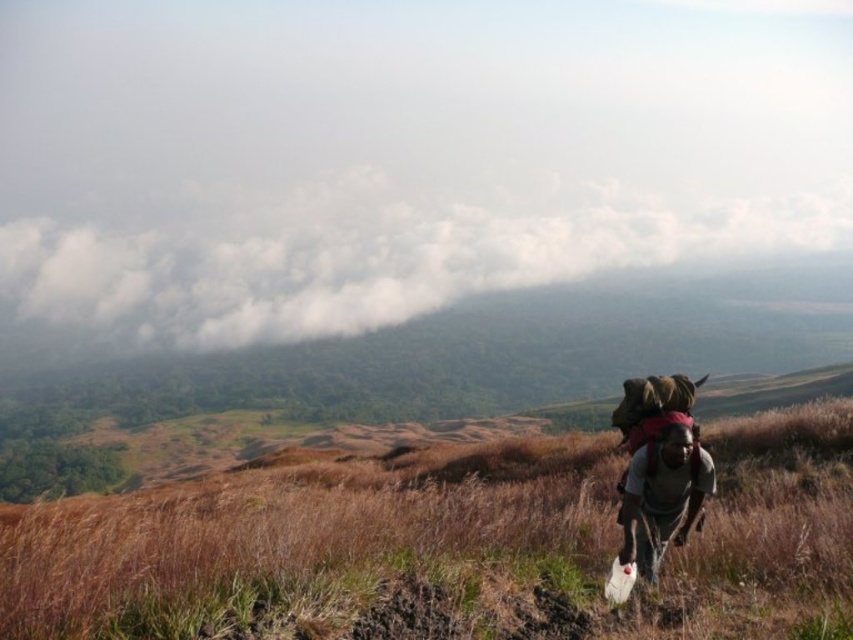
Question: Can you confirm if white fluffy cloud at upper left is positioned above gray fabric backpack at right?

Choices:
 (A) yes
 (B) no

Answer: (A)

Question: Which point is closer to the camera taking this photo?

Choices:
 (A) (16, 262)
 (B) (49, 529)

Answer: (B)

Question: Which point is farther from the camera taking this photo?

Choices:
 (A) (286, 317)
 (B) (601, 468)
 (C) (634, 486)

Answer: (A)

Question: Which object is closer to the camera taking this photo?

Choices:
 (A) gray fabric backpack at right
 (B) brown dry grass at lower right
 (C) white fluffy cloud at upper left

Answer: (B)

Question: Does brown dry grass at lower right have a lesser width compared to gray fabric backpack at right?

Choices:
 (A) no
 (B) yes

Answer: (A)

Question: Can you confirm if brown dry grass at lower right is bigger than white fluffy cloud at upper left?

Choices:
 (A) no
 (B) yes

Answer: (A)